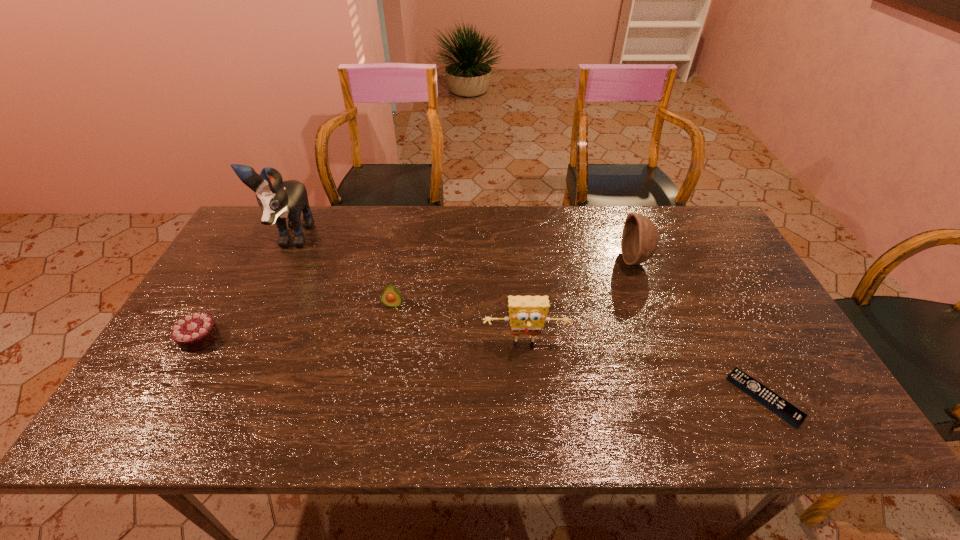
You are a GUI agent. You are given a task and a screenshot of the screen. Output one action in this format:
    pyautogui.click(x=<x>, y=<y>)
    Task: Click on the chocolate cake situated at the left edge
    Image resolution: width=960 pixels, height=540 pixels.
    Given the screenshot: What is the action you would take?
    pyautogui.click(x=194, y=332)

At what (x,y) coordinates should I click in order to perform the action: click on object that is at the right edge. Please return your answer as a coordinate pair (x, y). Image resolution: width=960 pixels, height=540 pixels. Looking at the image, I should click on coord(781,407).

The width and height of the screenshot is (960, 540). I want to click on object present at the far left corner, so coord(278,199).

What are the coordinates of `object positioned at the near right corner` in the screenshot? It's located at (781, 407).

Find the location of `vacant space at the far edge of the desktop`. vacant space at the far edge of the desktop is located at coordinates (652, 208).

Identify the location of free location at the near edge of the desktop. This screenshot has width=960, height=540. (258, 416).

Locate an element on the screen. The height and width of the screenshot is (540, 960). vacant space at the left edge of the desktop is located at coordinates (238, 308).

This screenshot has height=540, width=960. I want to click on vacant space at the right edge of the desktop, so [705, 259].

Locate an element on the screen. The height and width of the screenshot is (540, 960). vacant space at the far left corner of the desktop is located at coordinates (264, 230).

In the image, there is a desktop. Identify the location of vacant space at the far right corner. (695, 228).